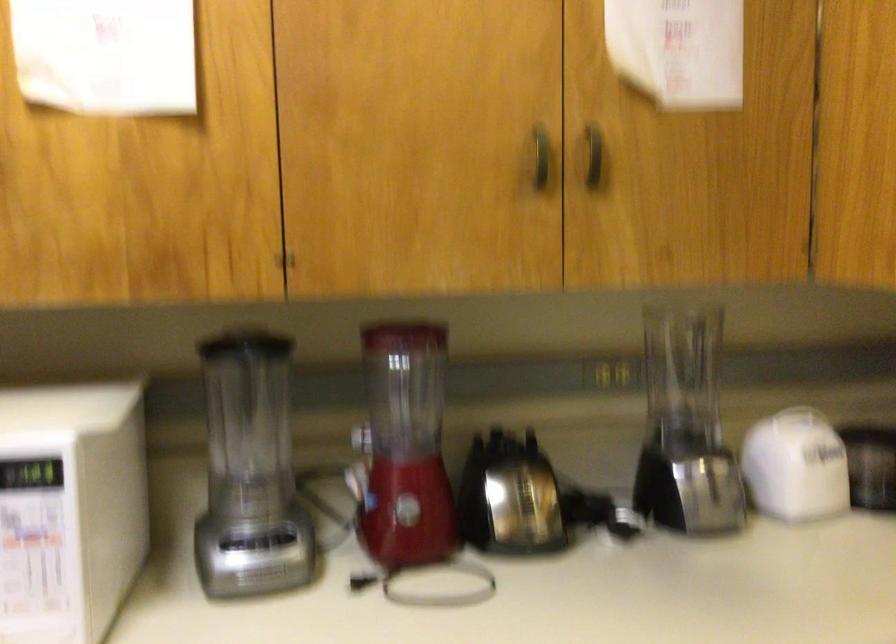
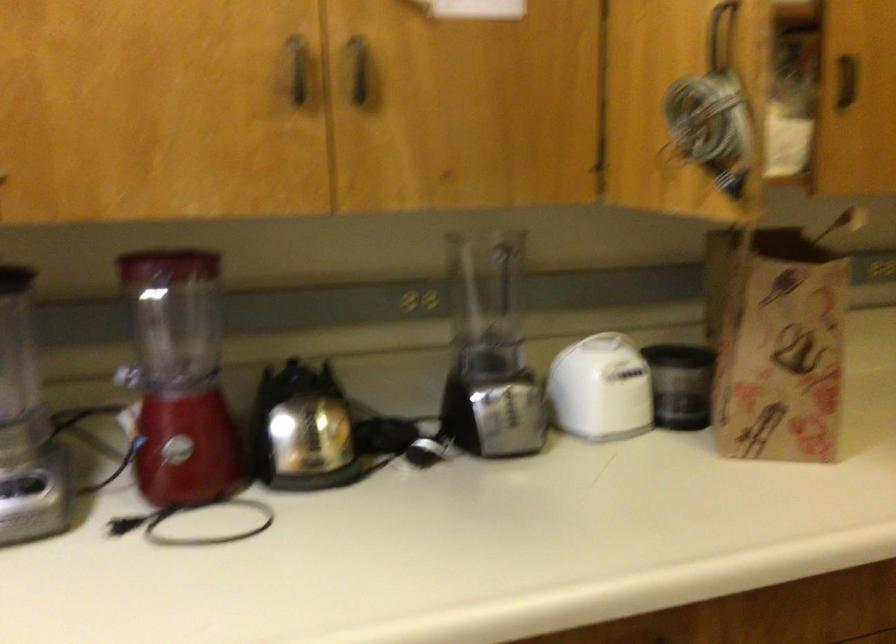
In the second image, find the point that corresponds to [595,166] in the first image.

(359, 69)